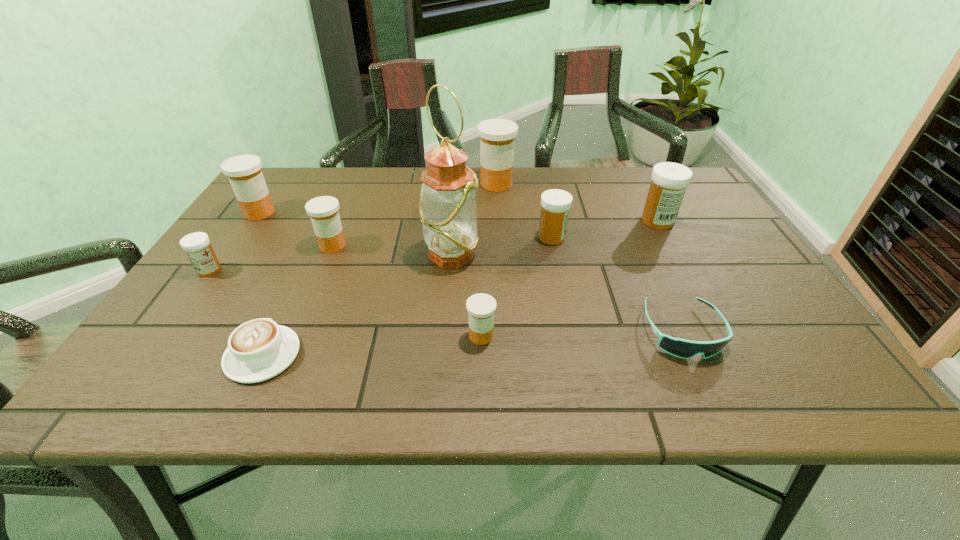
Identify the location of free area in between the third farthest orange medicine and the second nearest medicine. This screenshot has height=540, width=960. (271, 258).

The width and height of the screenshot is (960, 540). I want to click on vacant point located between the nearest medicine and the cappuccino, so click(372, 346).

Find the location of a particular element. Image resolution: width=960 pixels, height=540 pixels. free space that is in between the cyan sunglasses and the nearest orange medicine is located at coordinates (582, 334).

Find the location of a particular element. Image resolution: width=960 pixels, height=540 pixels. free area in between the cappuccino and the third biggest orange medicine is located at coordinates (298, 300).

Locate an element on the screen. Image resolution: width=960 pixels, height=540 pixels. free space between the biggest white medicine and the farthest medicine is located at coordinates (577, 202).

Find the location of `unoccupied area between the rightmost medicine and the cyan sunglasses`. unoccupied area between the rightmost medicine and the cyan sunglasses is located at coordinates (670, 276).

Locate an element on the screen. Image resolution: width=960 pixels, height=540 pixels. unoccupied position between the oil lamp and the second smallest orange medicine is located at coordinates (392, 251).

I want to click on free spot between the smallest orange medicine and the cyan sunglasses, so click(582, 334).

Identify which object is the eighth closest to the biggest orange medicine. Please provide its 2D coordinates. Your answer should be formatted as a tuple, i.e. [(x, y)], where the tuple contains the x and y coordinates of a point satisfying the conditions above.

[(260, 349)]

Where is `the closest object to the smallest white medicine`? The width and height of the screenshot is (960, 540). the closest object to the smallest white medicine is located at coordinates (244, 172).